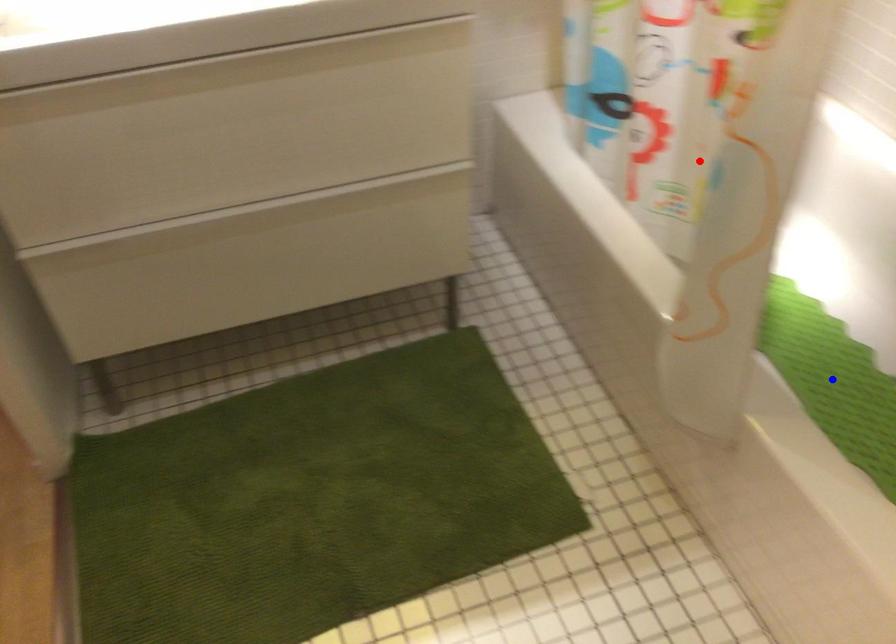
Question: Two points are marked on the image. Which point is closer to the camera?

Choices:
 (A) Blue point is closer.
 (B) Red point is closer.

Answer: (B)